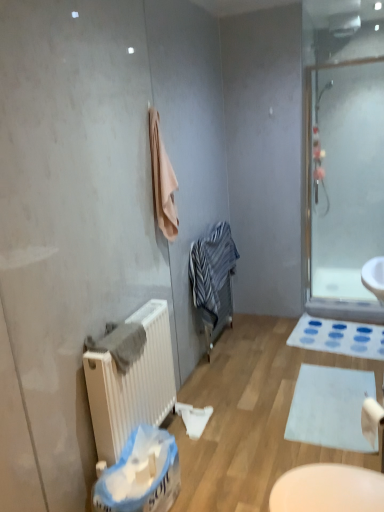
The image size is (384, 512). Describe the element at coordinates (331, 408) in the screenshot. I see `white matte bath mat at lower center, acting as the first bath mat starting from the bottom` at that location.

The height and width of the screenshot is (512, 384). What do you see at coordinates (371, 418) in the screenshot? I see `white matte toilet paper at lower right` at bounding box center [371, 418].

The height and width of the screenshot is (512, 384). Find the location of `white matte radiator at lower left`. white matte radiator at lower left is located at coordinates (131, 384).

Describe the element at coordinates (212, 267) in the screenshot. Image resolution: width=384 pixels, height=512 pixels. I see `striped cotton bathrobe at center` at that location.

The height and width of the screenshot is (512, 384). What do you see at coordinates (123, 343) in the screenshot?
I see `gray cotton towel at left, which is counted as the 1th bath towel, starting from the bottom` at bounding box center [123, 343].

Measure the distance between point (158,136) and camera.

They are 7.24 feet apart.

What do you see at coordinates (162, 180) in the screenshot?
I see `beige soft towel at upper center, which is counted as the first bath towel, starting from the top` at bounding box center [162, 180].

The height and width of the screenshot is (512, 384). What are the coordinates of `white fabric bath mat at lower right, placed as the 1th bath mat when sorted from back to front` in the screenshot? It's located at (339, 337).

Is point (138, 343) closer to camera compared to point (350, 342)?

Yes, it is.

From a real-world perspective, does gray cotton towel at left, acting as the first bath towel starting from the front, sit lower than white fabric bath mat at lower right, placed as the 1th bath mat when sorted from back to front?

Actually, gray cotton towel at left, acting as the first bath towel starting from the front, is physically above white fabric bath mat at lower right, placed as the 1th bath mat when sorted from back to front, in the real world.

Is white fabric bath mat at lower right, which is counted as the 2th bath mat, starting from the front, at the back of gray cotton towel at left, which is counted as the 2th bath towel, starting from the back?

No.

From the image's perspective, between striped cotton bathrobe at center and gray cotton towel at left, the 1th bath towel in the left-to-right sequence, which one is located above?

striped cotton bathrobe at center is shown above in the image.

Is striped cotton bathrobe at center facing towards gray cotton towel at left, which is counted as the 1th bath towel, starting from the bottom?

No, striped cotton bathrobe at center is not aimed at gray cotton towel at left, which is counted as the 1th bath towel, starting from the bottom.

At what (x,y) coordinates should I click in order to perform the action: click on bathrobe above the gray cotton towel at left, positioned as the 2th bath towel in top-to-bottom order (from the image's perspective). Please return your answer as a coordinate pair (x, y). The height and width of the screenshot is (512, 384). Looking at the image, I should click on (212, 267).

Considering the positions of objects striped cotton bathrobe at center and gray cotton towel at left, positioned as the 2th bath towel in top-to-bottom order, in the image provided, who is more to the left, striped cotton bathrobe at center or gray cotton towel at left, positioned as the 2th bath towel in top-to-bottom order,?

gray cotton towel at left, positioned as the 2th bath towel in top-to-bottom order.

Are blue plastic laundry basket at lower center and transparent glass shower door at right making contact?

No.

Who is taller, blue plastic laundry basket at lower center or transparent glass shower door at right?

Standing taller between the two is transparent glass shower door at right.

Which object is closer to the camera taking this photo, blue plastic laundry basket at lower center or transparent glass shower door at right?

Positioned in front is blue plastic laundry basket at lower center.

From the image's perspective, is blue plastic laundry basket at lower center located beneath transparent glass shower door at right?

Indeed, from the image's perspective, blue plastic laundry basket at lower center is shown beneath transparent glass shower door at right.

This screenshot has width=384, height=512. I want to click on bath mat that is the 2nd object to the right of the striped cotton bathrobe at center, starting at the anchor, so click(x=339, y=337).

Which of these two, striped cotton bathrobe at center or white fabric bath mat at lower right, which ranks as the second bath mat in bottom-to-top order, stands taller?

striped cotton bathrobe at center.

Is striped cotton bathrobe at center not close to white fabric bath mat at lower right, placed as the 1th bath mat when sorted from back to front?

striped cotton bathrobe at center is near white fabric bath mat at lower right, placed as the 1th bath mat when sorted from back to front, not far away.

Considering the relative sizes of striped cotton bathrobe at center and white fabric bath mat at lower right, placed as the 1th bath mat when sorted from back to front, in the image provided, is striped cotton bathrobe at center bigger than white fabric bath mat at lower right, placed as the 1th bath mat when sorted from back to front,?

Indeed, striped cotton bathrobe at center has a larger size compared to white fabric bath mat at lower right, placed as the 1th bath mat when sorted from back to front.

Considering the relative positions of striped cotton bathrobe at center and white matte toilet paper at lower right in the image provided, is striped cotton bathrobe at center behind white matte toilet paper at lower right?

Yes, the depth of striped cotton bathrobe at center is greater than that of white matte toilet paper at lower right.

Is striped cotton bathrobe at center to the right of white matte toilet paper at lower right from the viewer's perspective?

No.

Is striped cotton bathrobe at center beside white matte toilet paper at lower right?

striped cotton bathrobe at center and white matte toilet paper at lower right are clearly separated.

Is point (300, 440) positioned behind point (305, 320)?

No, (300, 440) is in front of (305, 320).

What's the angular difference between white matte bath mat at lower center, marked as the second bath mat in a back-to-front arrangement, and white fabric bath mat at lower right, which ranks as the second bath mat in bottom-to-top order,'s facing directions?

The angular difference between white matte bath mat at lower center, marked as the second bath mat in a back-to-front arrangement, and white fabric bath mat at lower right, which ranks as the second bath mat in bottom-to-top order, is 82.9 degrees.

Could you tell me if white matte bath mat at lower center, placed as the 1th bath mat when sorted from front to back, is facing white fabric bath mat at lower right, which ranks as the second bath mat in bottom-to-top order?

No, white matte bath mat at lower center, placed as the 1th bath mat when sorted from front to back, does not turn towards white fabric bath mat at lower right, which ranks as the second bath mat in bottom-to-top order.

Locate an element on the screen. The width and height of the screenshot is (384, 512). bath mat that appears below the white fabric bath mat at lower right, which is counted as the 2th bath mat, starting from the front (from a real-world perspective) is located at coordinates (331, 408).

From a real-world perspective, which is physically above, striped cotton bathrobe at center or white matte bath mat at lower center, placed as the 1th bath mat when sorted from front to back?

striped cotton bathrobe at center is physically above.

Identify the location of the 2nd bath mat below when counting from the striped cotton bathrobe at center (from the image's perspective). (331, 408).

From the image's perspective, which one is positioned lower, striped cotton bathrobe at center or white matte bath mat at lower center, acting as the first bath mat starting from the bottom?

white matte bath mat at lower center, acting as the first bath mat starting from the bottom, appears lower in the image.

Locate an element on the screen. This screenshot has width=384, height=512. the 2nd bath mat counting from the right side of the gray cotton towel at left, placed as the second bath towel when sorted from right to left is located at coordinates (339, 337).

At what (x,y) coordinates should I click in order to perform the action: click on the 2nd bath towel in front of the striped cotton bathrobe at center. Please return your answer as a coordinate pair (x, y). This screenshot has width=384, height=512. Looking at the image, I should click on (123, 343).

Considering their positions, is white fabric bath mat at lower right, which is the 1th bath mat in top-to-bottom order, positioned further to beige soft towel at upper center, which is counted as the first bath towel, starting from the right, than striped cotton bathrobe at center?

Based on the image, white fabric bath mat at lower right, which is the 1th bath mat in top-to-bottom order, appears to be further to beige soft towel at upper center, which is counted as the first bath towel, starting from the right.

When comparing their distances from striped cotton bathrobe at center, does white matte toilet paper at lower right or blue plastic laundry basket at lower center seem further?

The object further to striped cotton bathrobe at center is white matte toilet paper at lower right.

Which object lies nearer to the anchor point beige soft towel at upper center, which is counted as the 2th bath towel, starting from the left, blue plastic laundry basket at lower center or white matte radiator at lower left?

white matte radiator at lower left.

When comparing their distances from beige soft towel at upper center, which ranks as the 2th bath towel in front-to-back order, does white fabric bath mat at lower right, which is the 1th bath mat in top-to-bottom order, or transparent glass shower door at right seem closer?

The object closer to beige soft towel at upper center, which ranks as the 2th bath towel in front-to-back order, is transparent glass shower door at right.

Estimate the real-world distances between objects in this image. Which object is closer to transparent glass shower door at right, white matte toilet paper at lower right or white matte bath mat at lower center, which is the second bath mat from top to bottom?

white matte bath mat at lower center, which is the second bath mat from top to bottom, lies closer to transparent glass shower door at right than the other object.

Based on the photo, from the image, which object appears to be farther from white matte bath mat at lower center, which is the second bath mat from top to bottom, beige soft towel at upper center, which is counted as the 2th bath towel, starting from the left, or transparent glass shower door at right?

beige soft towel at upper center, which is counted as the 2th bath towel, starting from the left, is further to white matte bath mat at lower center, which is the second bath mat from top to bottom.

Estimate the real-world distances between objects in this image. Which object is closer to transparent glass shower door at right, striped cotton bathrobe at center or white fabric bath mat at lower right, which ranks as the second bath mat in bottom-to-top order?

Among the two, white fabric bath mat at lower right, which ranks as the second bath mat in bottom-to-top order, is located nearer to transparent glass shower door at right.

Considering their positions, is white matte bath mat at lower center, marked as the second bath mat in a back-to-front arrangement, positioned further to white matte radiator at lower left than striped cotton bathrobe at center?

white matte bath mat at lower center, marked as the second bath mat in a back-to-front arrangement, lies further to white matte radiator at lower left than the other object.

I want to click on bathrobe between white matte radiator at lower left and white matte bath mat at lower center, marked as the second bath mat in a back-to-front arrangement, in the horizontal direction, so pyautogui.click(x=212, y=267).

Locate an element on the screen. bath towel between beige soft towel at upper center, which is counted as the first bath towel, starting from the top, and white matte toilet paper at lower right, in the vertical direction is located at coordinates (123, 343).

At what (x,y) coordinates should I click in order to perform the action: click on bathrobe situated between white matte radiator at lower left and white fabric bath mat at lower right, placed as the 1th bath mat when sorted from back to front, from left to right. Please return your answer as a coordinate pair (x, y). Looking at the image, I should click on (212, 267).

Where is `bathrobe between beige soft towel at upper center, which ranks as the 2th bath towel in front-to-back order, and white matte radiator at lower left from top to bottom`? The image size is (384, 512). bathrobe between beige soft towel at upper center, which ranks as the 2th bath towel in front-to-back order, and white matte radiator at lower left from top to bottom is located at coordinates (212, 267).